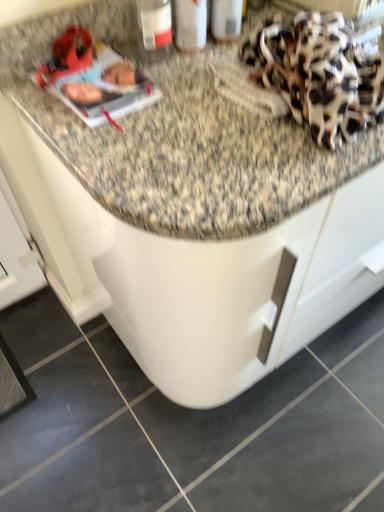
Question: From a real-world perspective, is matte plastic bottle at upper center over matte plastic magazine at upper left?

Choices:
 (A) no
 (B) yes

Answer: (B)

Question: Can you confirm if matte plastic bottle at upper center is wider than matte plastic magazine at upper left?

Choices:
 (A) no
 (B) yes

Answer: (A)

Question: Can you confirm if matte plastic bottle at upper center is shorter than matte plastic magazine at upper left?

Choices:
 (A) no
 (B) yes

Answer: (A)

Question: Can you confirm if matte plastic bottle at upper center is positioned to the left of matte plastic magazine at upper left?

Choices:
 (A) yes
 (B) no

Answer: (B)

Question: Is matte plastic bottle at upper center directly adjacent to matte plastic magazine at upper left?

Choices:
 (A) yes
 (B) no

Answer: (B)

Question: From the image's perspective, is matte plastic bottle at upper center beneath matte plastic magazine at upper left?

Choices:
 (A) no
 (B) yes

Answer: (A)

Question: Is leopard print fabric at upper right positioned beyond the bounds of matte plastic bottle at upper center?

Choices:
 (A) yes
 (B) no

Answer: (A)

Question: Can you confirm if leopard print fabric at upper right is shorter than matte plastic bottle at upper center?

Choices:
 (A) no
 (B) yes

Answer: (B)

Question: From a real-world perspective, does leopard print fabric at upper right sit lower than matte plastic bottle at upper center?

Choices:
 (A) yes
 (B) no

Answer: (A)

Question: Is leopard print fabric at upper right at the right side of matte plastic bottle at upper center?

Choices:
 (A) no
 (B) yes

Answer: (B)

Question: Is leopard print fabric at upper right facing towards matte plastic bottle at upper center?

Choices:
 (A) yes
 (B) no

Answer: (B)

Question: Considering the relative sizes of leopard print fabric at upper right and matte plastic bottle at upper center in the image provided, is leopard print fabric at upper right smaller than matte plastic bottle at upper center?

Choices:
 (A) no
 (B) yes

Answer: (A)

Question: Would you say matte plastic magazine at upper left is outside matte plastic bottle at upper center?

Choices:
 (A) no
 (B) yes

Answer: (B)